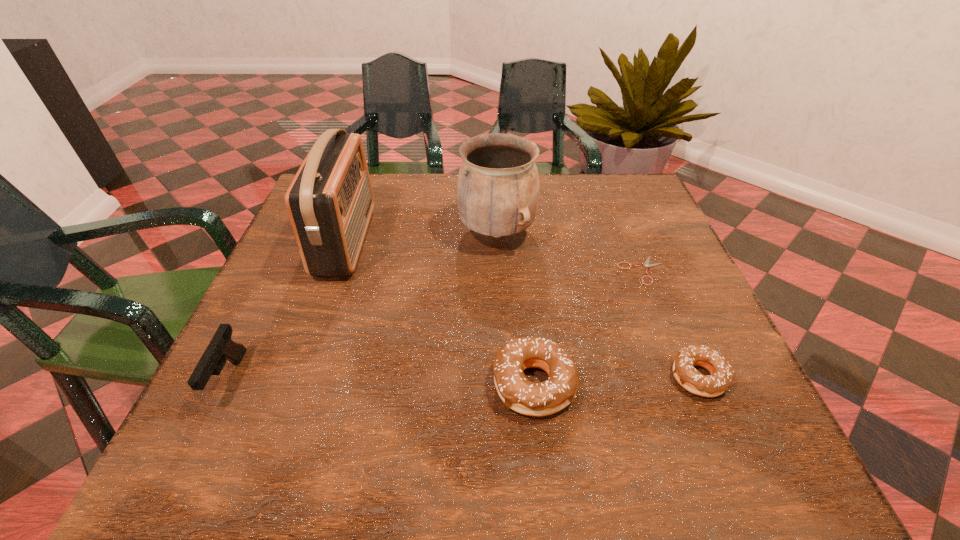
In order to click on shears present at the right edge in this screenshot , I will do `click(647, 265)`.

Find the location of a particular element. object positioned at the far left corner is located at coordinates (330, 201).

Where is `object that is at the near left corner`? object that is at the near left corner is located at coordinates (221, 347).

You are a GUI agent. You are given a task and a screenshot of the screen. Output one action in this format:
    pyautogui.click(x=<x>, y=<y>)
    Task: Click on the object located at the near right corner
    
    Given the screenshot: What is the action you would take?
    pyautogui.click(x=721, y=371)

Find the location of `vacant space at the far edge of the desktop`. vacant space at the far edge of the desktop is located at coordinates (443, 182).

At what (x,y) coordinates should I click in order to perform the action: click on free space at the near edge. Please return your answer as a coordinate pair (x, y). This screenshot has height=540, width=960. Looking at the image, I should click on (599, 396).

What are the coordinates of `free region at the left edge of the desktop` in the screenshot? It's located at (311, 330).

Locate an element on the screen. The height and width of the screenshot is (540, 960). vacant space at the right edge of the desktop is located at coordinates (704, 336).

Identify the location of vacant space in between the second shortest object and the fourth tallest object. (616, 380).

This screenshot has width=960, height=540. In order to click on blank region between the pistol and the left doughnut in this screenshot , I will do `click(382, 381)`.